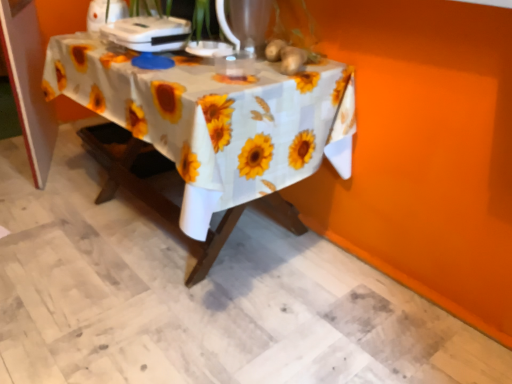
Question: Is yellow matte sunflower at upper center, the second flower viewed from the back, situated inside yellow matte sunflower at upper center, the 2th flower from the front, or outside?

Choices:
 (A) outside
 (B) inside

Answer: (A)

Question: In terms of height, does yellow matte sunflower at upper center, the second flower viewed from the back, look taller or shorter compared to yellow matte sunflower at upper center, the first flower from the back?

Choices:
 (A) short
 (B) tall

Answer: (B)

Question: Estimate the real-world distances between objects in this image. Which object is closer to the white fabric tablecloth at center?

Choices:
 (A) white plastic appliance at upper center, placed as the 1th appliance when sorted from right to left
 (B) yellow matte sunflower at upper center, the first flower from the back
 (C) yellow matte sunflower at upper center, the second flower viewed from the back
 (D) white plastic appliance at upper center, which is the 1th appliance in left-to-right order

Answer: (A)

Question: Estimate the real-world distances between objects in this image. Which object is closer to the yellow matte sunflower at upper center, the 1th flower from the front?

Choices:
 (A) white plastic appliance at upper center, placed as the 1th appliance when sorted from right to left
 (B) yellow matte sunflower at upper center, the 2th flower from the front
 (C) white plastic appliance at upper center, which is the 1th appliance in left-to-right order
 (D) white fabric tablecloth at center

Answer: (B)